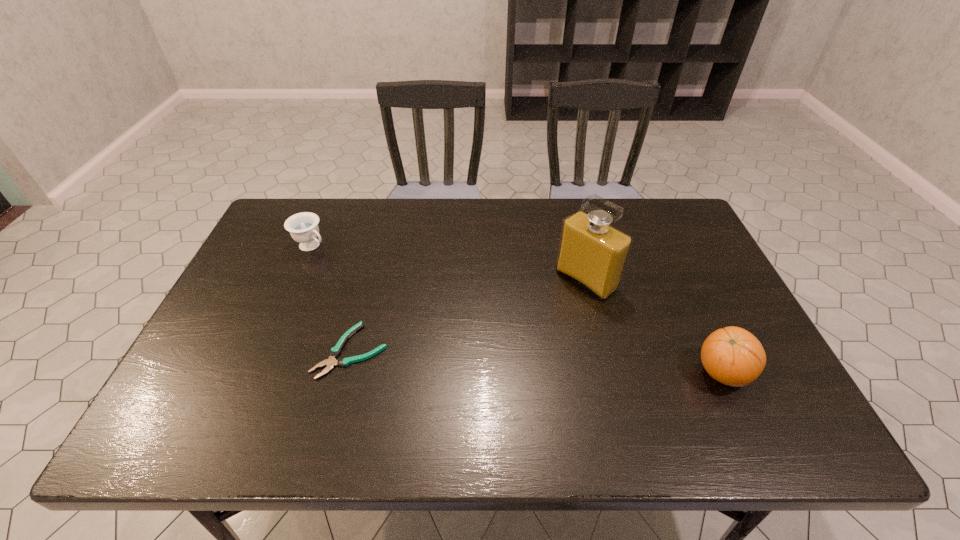
Locate an element on the screen. This screenshot has width=960, height=540. vacant space situated on the side of the teacup with the handle is located at coordinates (380, 288).

Image resolution: width=960 pixels, height=540 pixels. I want to click on vacant region located 0.100m on the side of the teacup with the handle, so click(x=346, y=266).

I want to click on blank space located 0.270m on the side of the teacup with the handle, so pos(385,291).

In order to click on vacant space located 0.050m on the front-facing side of the tallest object in this screenshot , I will do `click(556, 304)`.

In order to click on free space located 0.160m on the front-facing side of the tallest object in this screenshot , I will do `click(528, 326)`.

The width and height of the screenshot is (960, 540). I want to click on vacant space located on the front-facing side of the tallest object, so click(504, 345).

Locate an element on the screen. This screenshot has height=540, width=960. object present at the far edge is located at coordinates (303, 227).

This screenshot has width=960, height=540. In order to click on pliers situated at the near edge in this screenshot , I will do `click(336, 350)`.

You are a GUI agent. You are given a task and a screenshot of the screen. Output one action in this format:
    pyautogui.click(x=<x>, y=<y>)
    Task: Click on the orange that is at the near edge
    
    Given the screenshot: What is the action you would take?
    pyautogui.click(x=733, y=356)

Locate an element on the screen. The width and height of the screenshot is (960, 540). object situated at the left edge is located at coordinates (303, 227).